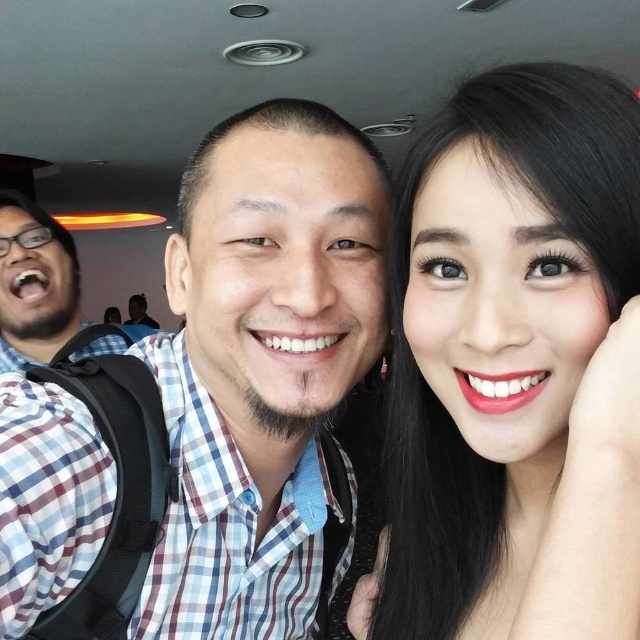
Which is behind, point (476, 387) or point (12, 202)?

Positioned behind is point (12, 202).

Is smooth skin at upper right thinner than matte plaid shirt at left?

Indeed, smooth skin at upper right has a lesser width compared to matte plaid shirt at left.

Does point (435, 392) come farther from viewer compared to point (74, 259)?

No, it is not.

Image resolution: width=640 pixels, height=640 pixels. Find the location of `smooth skin at upper right`. smooth skin at upper right is located at coordinates (515, 369).

Does smooth skin at upper right appear under blue plaid shirt at center?

No, smooth skin at upper right is not below blue plaid shirt at center.

Does smooth skin at upper right appear on the right side of blue plaid shirt at center?

Yes, smooth skin at upper right is to the right of blue plaid shirt at center.

The image size is (640, 640). Identify the location of smooth skin at upper right. [x=515, y=369].

Who is lower down, blue plaid shirt at center or matte plaid shirt at left?

blue plaid shirt at center is below.

Describe the element at coordinates (260, 364) in the screenshot. The image size is (640, 640). I see `blue plaid shirt at center` at that location.

I want to click on blue plaid shirt at center, so click(260, 364).